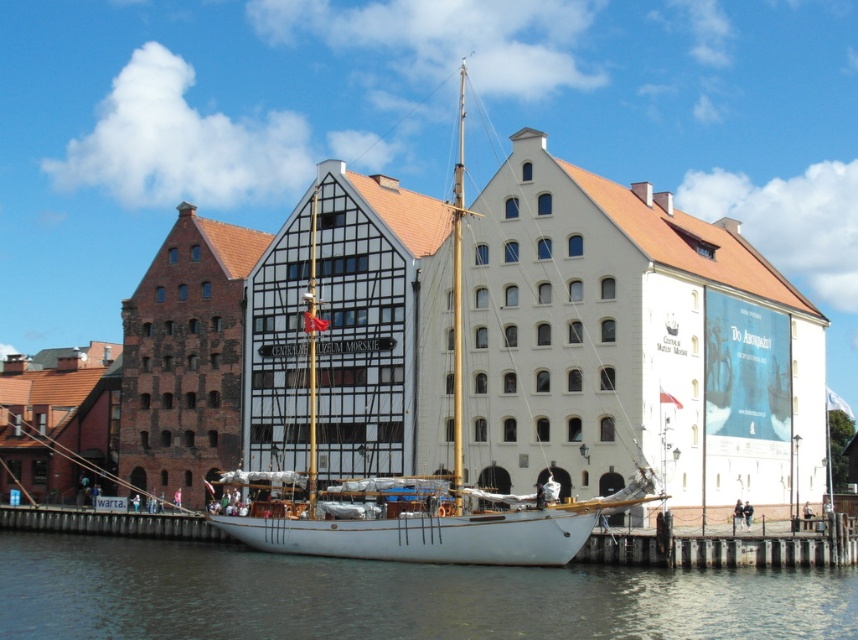
Question: Is transparent water at lower center above wooden dock at lower center?

Choices:
 (A) no
 (B) yes

Answer: (B)

Question: Can you confirm if transparent water at lower center is bigger than wooden dock at lower center?

Choices:
 (A) no
 (B) yes

Answer: (B)

Question: Which point is closer to the camera?

Choices:
 (A) (837, 547)
 (B) (313, 324)

Answer: (A)

Question: Which object appears farthest from the camera in this image?

Choices:
 (A) transparent water at lower center
 (B) wooden dock at lower center
 (C) white matte sailboat at center

Answer: (B)

Question: In this image, where is white matte sailboat at center located relative to transparent water at lower center?

Choices:
 (A) below
 (B) above

Answer: (B)

Question: Which object is closer to the camera taking this photo?

Choices:
 (A) wooden dock at lower center
 (B) transparent water at lower center
 (C) white matte sailboat at center

Answer: (B)